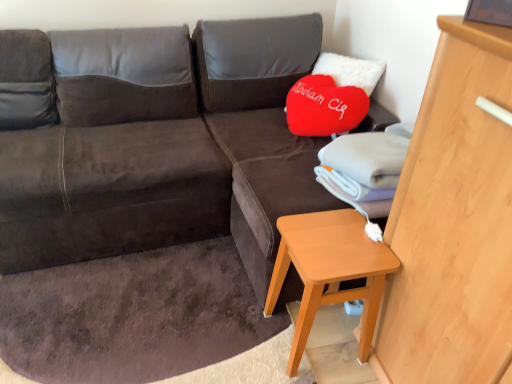
Question: Considering the relative positions of light wood dresser at right and dark brown fabric couch at center in the image provided, is light wood dresser at right to the right of dark brown fabric couch at center from the viewer's perspective?

Choices:
 (A) no
 (B) yes

Answer: (B)

Question: Is light wood dresser at right positioned with its back to dark brown fabric couch at center?

Choices:
 (A) yes
 (B) no

Answer: (B)

Question: Considering the relative sizes of light wood dresser at right and dark brown fabric couch at center in the image provided, is light wood dresser at right bigger than dark brown fabric couch at center?

Choices:
 (A) no
 (B) yes

Answer: (A)

Question: Is light wood dresser at right placed right next to dark brown fabric couch at center?

Choices:
 (A) no
 (B) yes

Answer: (A)

Question: Considering the relative positions of light wood dresser at right and dark brown fabric couch at center in the image provided, is light wood dresser at right to the left of dark brown fabric couch at center from the viewer's perspective?

Choices:
 (A) no
 (B) yes

Answer: (A)

Question: From the image's perspective, relative to orange wood side table at lower right, is suede-like brown bean bag at left above or below?

Choices:
 (A) above
 (B) below

Answer: (A)

Question: Is suede-like brown bean bag at left inside the boundaries of orange wood side table at lower right, or outside?

Choices:
 (A) outside
 (B) inside

Answer: (A)

Question: From a real-world perspective, is suede-like brown bean bag at left physically located above or below orange wood side table at lower right?

Choices:
 (A) below
 (B) above

Answer: (B)

Question: Considering the positions of suede-like brown bean bag at left and orange wood side table at lower right in the image, is suede-like brown bean bag at left bigger or smaller than orange wood side table at lower right?

Choices:
 (A) small
 (B) big

Answer: (B)

Question: In the image, is orange wood side table at lower right on the left side or the right side of dark brown fabric couch at center?

Choices:
 (A) left
 (B) right

Answer: (B)

Question: Is orange wood side table at lower right in front of or behind dark brown fabric couch at center in the image?

Choices:
 (A) front
 (B) behind

Answer: (B)

Question: In terms of width, does orange wood side table at lower right look wider or thinner when compared to dark brown fabric couch at center?

Choices:
 (A) wide
 (B) thin

Answer: (B)

Question: From the image's perspective, is orange wood side table at lower right above or below dark brown fabric couch at center?

Choices:
 (A) above
 (B) below

Answer: (B)

Question: From a real-world perspective, is dark brown fabric couch at center physically located above or below light wood dresser at right?

Choices:
 (A) below
 (B) above

Answer: (A)

Question: Is dark brown fabric couch at center taller or shorter than light wood dresser at right?

Choices:
 (A) tall
 (B) short

Answer: (B)